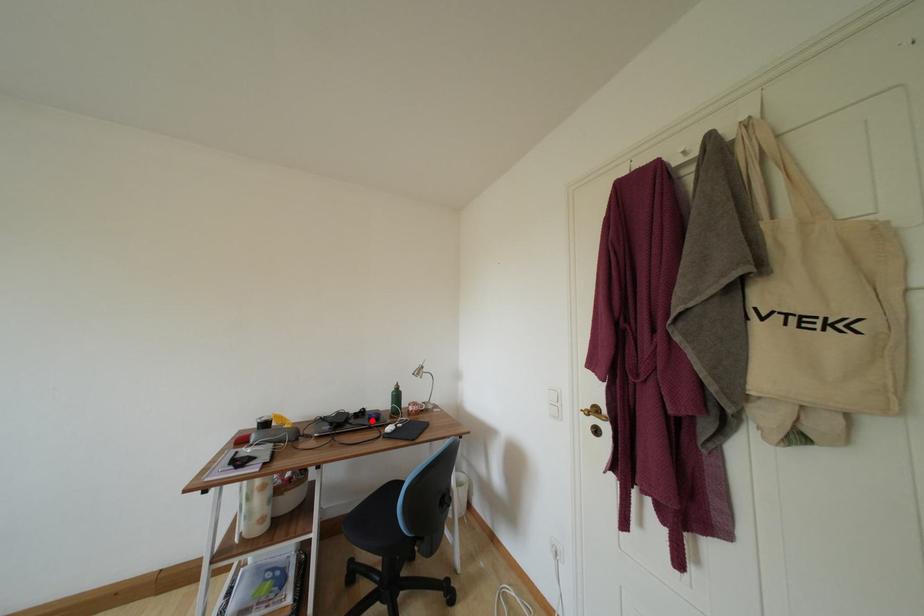
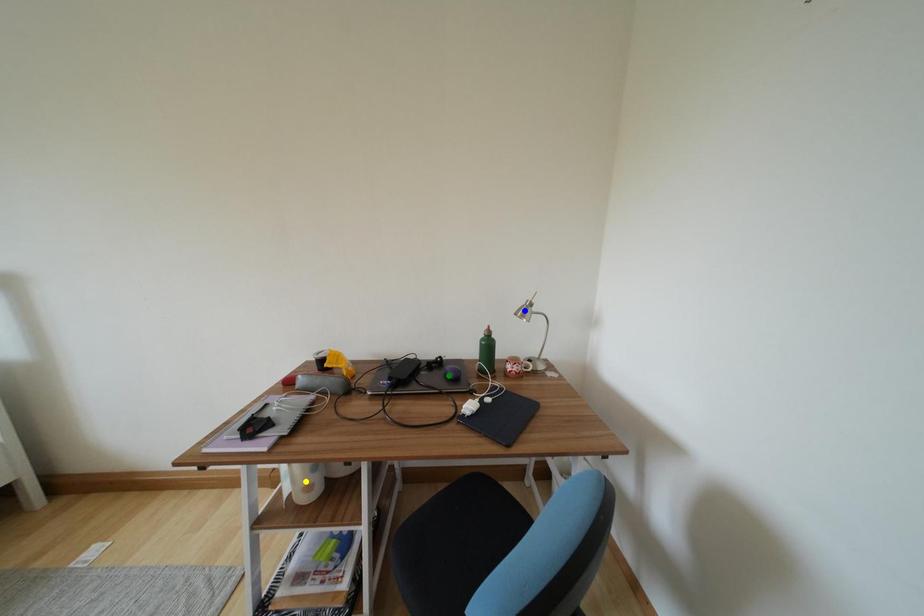
Question: I am providing you with two images of the same scene from different viewpoints. A red point is marked on the first image. You are given multiple points on the second image. Which mark in image 2 goes with the point in image 1?

Choices:
 (A) yellow point
 (B) blue point
 (C) green point

Answer: (C)